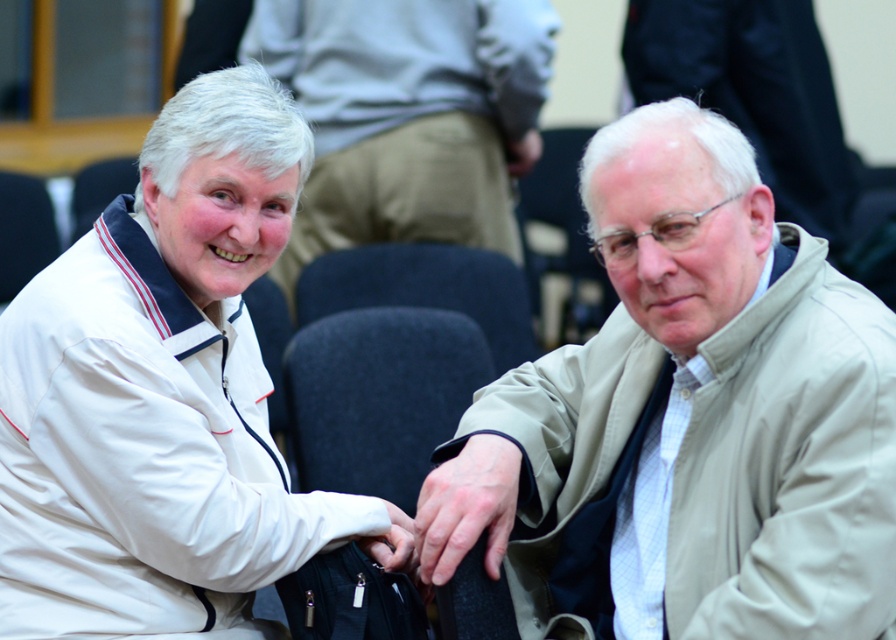
Who is lower down, smooth beige hand at center or white matte wristband at center?

white matte wristband at center is below.

Who is higher up, smooth beige hand at center or white matte wristband at center?

smooth beige hand at center

The width and height of the screenshot is (896, 640). What do you see at coordinates (467, 506) in the screenshot?
I see `smooth beige hand at center` at bounding box center [467, 506].

Where is `smooth beige hand at center`? This screenshot has height=640, width=896. smooth beige hand at center is located at coordinates (467, 506).

Is beige fabric jacket at upper right above dark gray fabric chair at center?

Actually, beige fabric jacket at upper right is below dark gray fabric chair at center.

Who is more distant from viewer, (85, 253) or (592, 131)?

The point (592, 131) is behind.

Locate an element on the screen. Image resolution: width=896 pixels, height=640 pixels. beige fabric jacket at upper right is located at coordinates click(161, 394).

Can you confirm if beige fabric jacket at right is smaller than white matte jacket at upper left?

Actually, beige fabric jacket at right might be larger than white matte jacket at upper left.

Image resolution: width=896 pixels, height=640 pixels. I want to click on beige fabric jacket at right, so click(688, 419).

Which is behind, point (739, 621) or point (507, 74)?

The point (507, 74) is more distant.

Find the location of a particular element. beige fabric jacket at right is located at coordinates (688, 419).